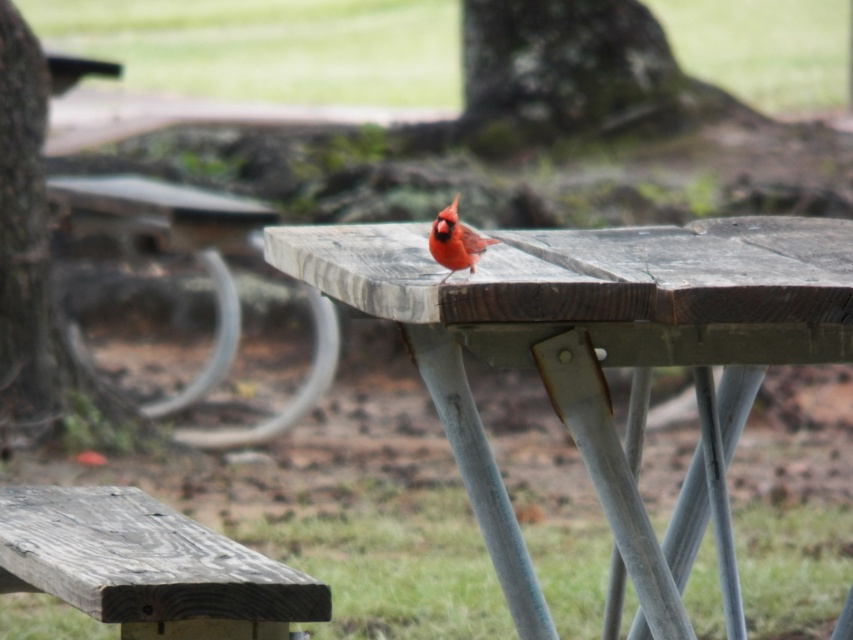
Who is taller, weathered wood bench at lower left or matte red cardinal at center?

With more height is weathered wood bench at lower left.

Who is more forward, [297,616] or [456,230]?

Point [456,230]

I want to click on weathered wood bench at lower left, so click(x=148, y=566).

Measure the distance between weathered wood bench at lower left and camera.

They are 11.38 feet apart.

Which is more to the right, weathered wood bench at lower left or smooth bark tree at left?

weathered wood bench at lower left

Which is behind, point (86, 516) or point (88, 412)?

Positioned behind is point (88, 412).

You are a GUI agent. You are given a task and a screenshot of the screen. Output one action in this format:
    pyautogui.click(x=<x>, y=<y>)
    Task: Click on the weathered wood bench at lower left
    The image size is (853, 640).
    Given the screenshot: What is the action you would take?
    pyautogui.click(x=148, y=566)

Which of these two, wooden picnic table at center or smooth bark tree at left, stands taller?

With more height is smooth bark tree at left.

Can you confirm if wooden picnic table at center is wider than smooth bark tree at left?

Correct, the width of wooden picnic table at center exceeds that of smooth bark tree at left.

Find the location of a particular element. wooden picnic table at center is located at coordinates (595, 353).